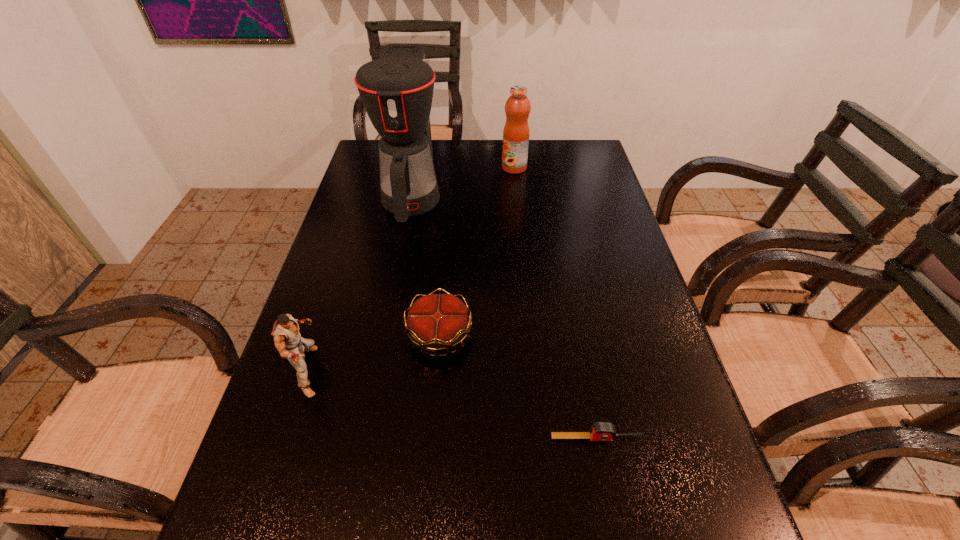
At what (x,y) coordinates should I click in order to perform the action: click on free point located 0.050m on the front label of the fruit juice. Please return your answer as a coordinate pair (x, y). Looking at the image, I should click on (487, 168).

Locate an element on the screen. The height and width of the screenshot is (540, 960). blank area located on the front-facing side of the puncher is located at coordinates (377, 371).

Locate an element on the screen. The width and height of the screenshot is (960, 540). free region located on the right of the crown is located at coordinates (516, 335).

Locate an element on the screen. vacant position located 0.330m on the back of the shortest object is located at coordinates (571, 303).

Where is `coffee maker located in the far edge section of the desktop`? The width and height of the screenshot is (960, 540). coffee maker located in the far edge section of the desktop is located at coordinates (397, 89).

Locate an element on the screen. The image size is (960, 540). fruit juice at the far edge is located at coordinates (516, 132).

Locate an element on the screen. The height and width of the screenshot is (540, 960). coffee maker that is at the left edge is located at coordinates (397, 89).

Where is `puncher that is at the left edge`? Image resolution: width=960 pixels, height=540 pixels. puncher that is at the left edge is located at coordinates (288, 341).

Where is `object located in the right edge section of the desktop`? object located in the right edge section of the desktop is located at coordinates (600, 431).

This screenshot has width=960, height=540. What are the coordinates of `object that is at the far left corner` in the screenshot? It's located at (397, 89).